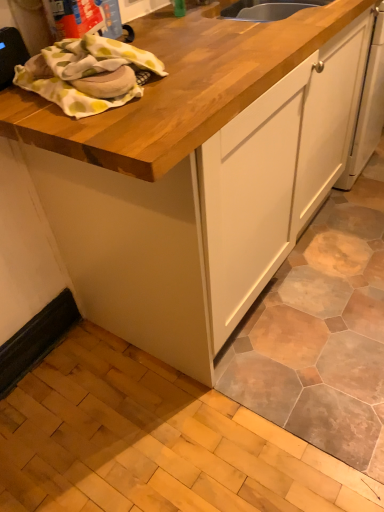
You are a GUI agent. You are given a task and a screenshot of the screen. Output one action in this format:
    pyautogui.click(x=<x>, y=<y>)
    Task: Click on the yellow-green polka dot fabric at upper left
    Image resolution: width=384 pixels, height=512 pixels.
    Given the screenshot: What is the action you would take?
    pyautogui.click(x=87, y=74)

What do you see at coordinates (87, 74) in the screenshot? This screenshot has height=512, width=384. I see `yellow-green polka dot fabric at upper left` at bounding box center [87, 74].

Image resolution: width=384 pixels, height=512 pixels. Find the location of `yellow-green polka dot fabric at upper left`. yellow-green polka dot fabric at upper left is located at coordinates (87, 74).